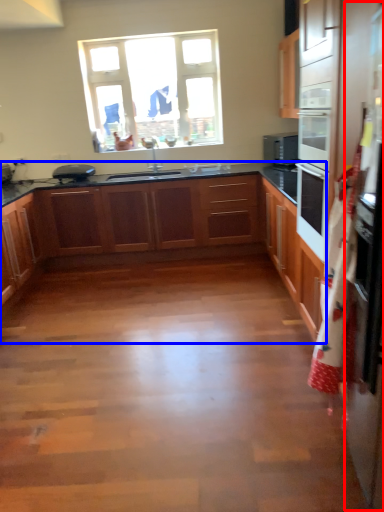
Question: Which object appears closest to the camera in this image, fridge (highlighted by a red box) or cabinetry (highlighted by a blue box)?

Choices:
 (A) fridge
 (B) cabinetry

Answer: (A)